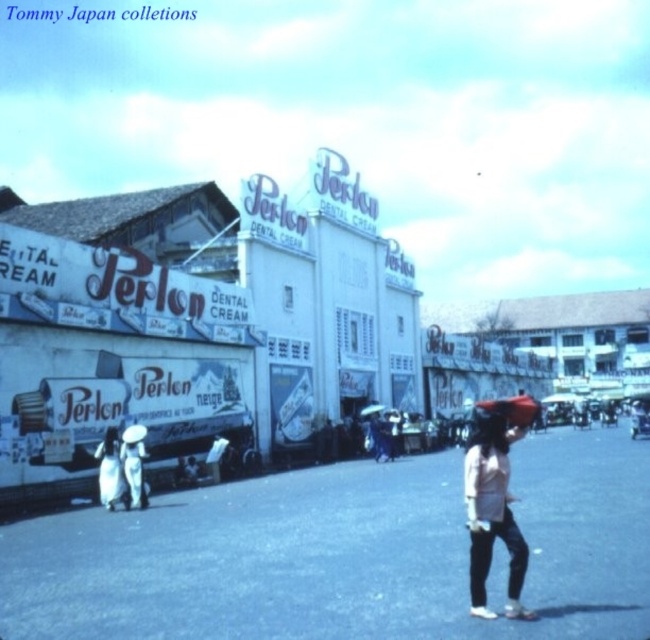
Does white matte shirt at center have a smaller size compared to white cotton dress at lower left?

No, white matte shirt at center is not smaller than white cotton dress at lower left.

Is point (474, 528) more distant than point (109, 442)?

No, it is not.

Locate an element on the screen. This screenshot has width=650, height=640. white matte shirt at center is located at coordinates (491, 509).